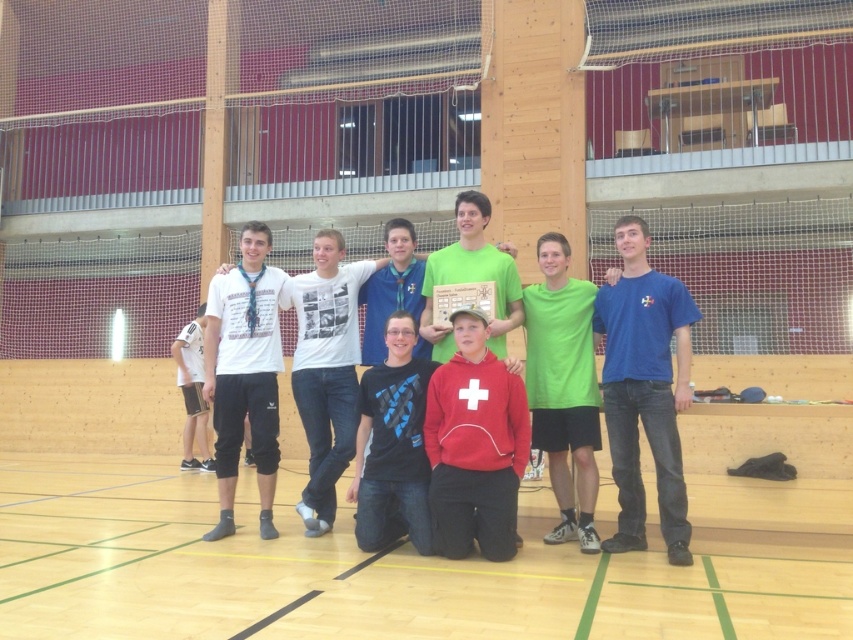
Can you confirm if wooden floor at lower center is positioned above black matte t-shirt at center?

Actually, wooden floor at lower center is below black matte t-shirt at center.

Is wooden floor at lower center shorter than black matte t-shirt at center?

Yes, wooden floor at lower center is shorter than black matte t-shirt at center.

Locate an element on the screen. The height and width of the screenshot is (640, 853). wooden floor at lower center is located at coordinates (368, 570).

Between wooden floor at lower center and green matte t-shirt at center, which one has more height?

With more height is green matte t-shirt at center.

Can you confirm if wooden floor at lower center is positioned to the right of green matte t-shirt at center?

In fact, wooden floor at lower center is to the left of green matte t-shirt at center.

Is point (328, 563) positioned before point (567, 468)?

Yes, point (328, 563) is in front of point (567, 468).

You are a GUI agent. You are given a task and a screenshot of the screen. Output one action in this format:
    pyautogui.click(x=<x>, y=<y>)
    Task: Click on the wooden floor at lower center
    
    Given the screenshot: What is the action you would take?
    pyautogui.click(x=368, y=570)

Where is `wooden floor at lower center`? The image size is (853, 640). wooden floor at lower center is located at coordinates (368, 570).

Is wooden floor at lower center to the left of blue cotton t-shirt at right from the viewer's perspective?

Indeed, wooden floor at lower center is positioned on the left side of blue cotton t-shirt at right.

Which is behind, point (834, 557) or point (671, 524)?

Point (834, 557)

Where is `wooden floor at lower center`? This screenshot has height=640, width=853. wooden floor at lower center is located at coordinates (368, 570).